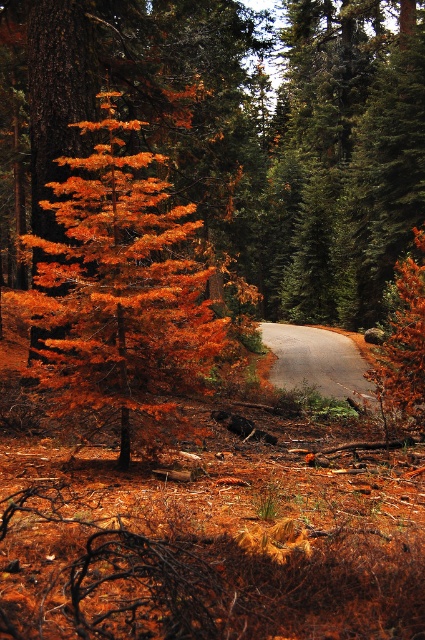
Does orange matte tree at center appear under gray asphalt road at center?

No, orange matte tree at center is not below gray asphalt road at center.

Does orange matte tree at center have a lesser width compared to gray asphalt road at center?

Correct, orange matte tree at center's width is less than gray asphalt road at center's.

Is point (193, 388) closer to viewer compared to point (348, 392)?

Yes.

Image resolution: width=425 pixels, height=640 pixels. I want to click on orange matte tree at center, so click(x=121, y=289).